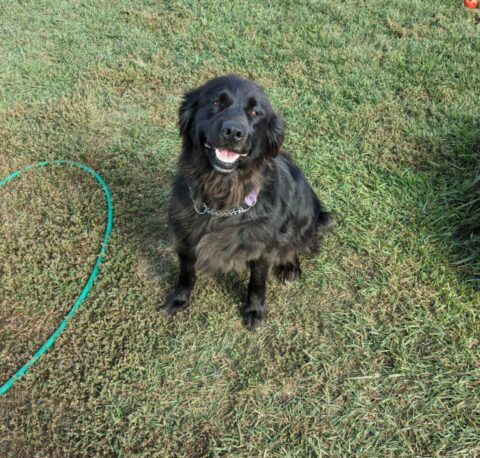
Locate an element on the screen. red toy at upper right corner is located at coordinates (471, 4).